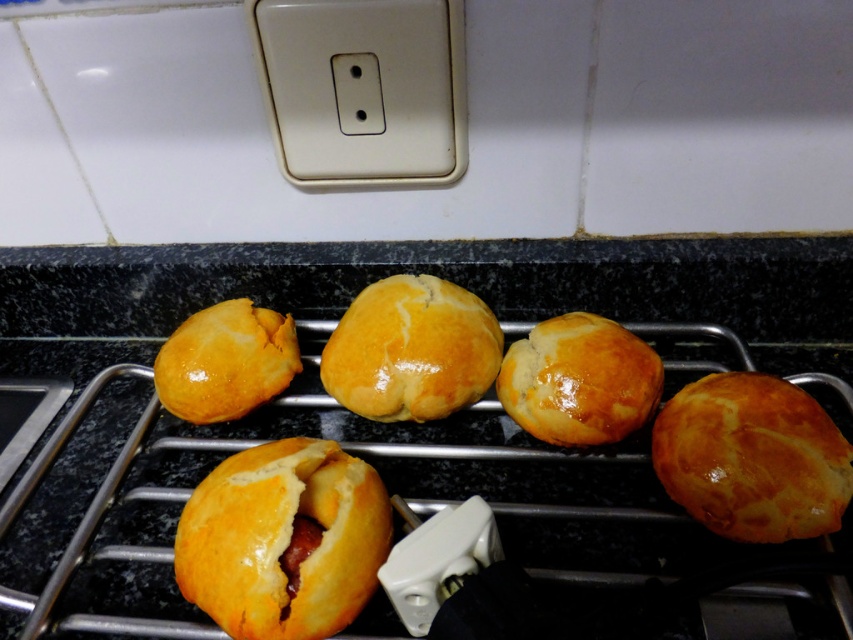
Looking at the golden matte bun at center and the glossy golden bun at left on the cooling rack, which one is taller?

The golden matte bun at center is taller than the glossy golden bun at left.

You are arranging pastries on a display. You have a golden matte bun at center and a glossy golden bun at left. According to the scene, which pastry should you place to the right of the other to match the original arrangement?

The golden matte bun at center should be placed to the right of the glossy golden bun at left to match the original arrangement.